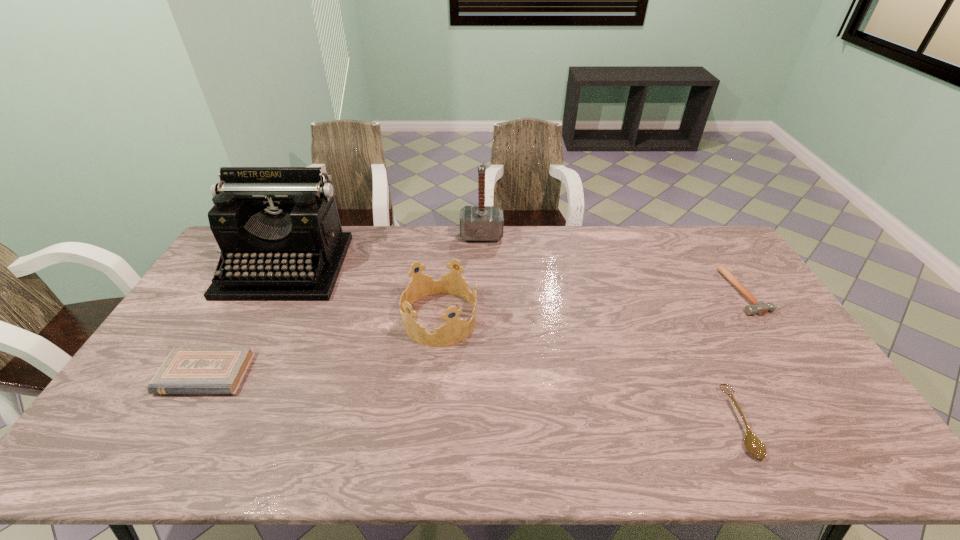
Where is `blank space located on the right of the left hammer`? This screenshot has height=540, width=960. blank space located on the right of the left hammer is located at coordinates [534, 236].

This screenshot has height=540, width=960. Find the location of `free location located 0.140m on the front-facing side of the fourth shortest object`. free location located 0.140m on the front-facing side of the fourth shortest object is located at coordinates (522, 319).

You are a GUI agent. You are given a task and a screenshot of the screen. Output one action in this format:
    pyautogui.click(x=<x>, y=<y>)
    Task: Click on the vacant region located on the spine side of the Bible
    The image size is (960, 540).
    Given the screenshot: What is the action you would take?
    pyautogui.click(x=166, y=443)

Where is `vacant point located 0.220m on the back of the shorter hammer`? This screenshot has width=960, height=540. vacant point located 0.220m on the back of the shorter hammer is located at coordinates (706, 233).

You are a GUI agent. You are given a task and a screenshot of the screen. Output one action in this format:
    pyautogui.click(x=<x>, y=<y>)
    Task: Click on the vacant region located on the right of the shortest object
    This screenshot has height=540, width=960.
    Given the screenshot: What is the action you would take?
    pyautogui.click(x=781, y=422)

You are a GUI agent. You are given a task and a screenshot of the screen. Output one action in this format:
    pyautogui.click(x=<x>, y=<y>)
    Task: Click on the typewriter present at the far edge
    The image size is (960, 540).
    Given the screenshot: What is the action you would take?
    pyautogui.click(x=278, y=228)

This screenshot has height=540, width=960. Identify the location of hammer present at the far edge. (477, 223).

The image size is (960, 540). Identify the location of object that is at the near edge. (754, 446).

You are a GUI agent. You are given a task and a screenshot of the screen. Output one action in this format:
    pyautogui.click(x=<x>, y=<y>)
    Task: Click on the typewriter situated at the left edge
    
    Given the screenshot: What is the action you would take?
    pyautogui.click(x=278, y=228)

The width and height of the screenshot is (960, 540). Find the location of `Bible that is positioned at the left edge`. Bible that is positioned at the left edge is located at coordinates (187, 369).